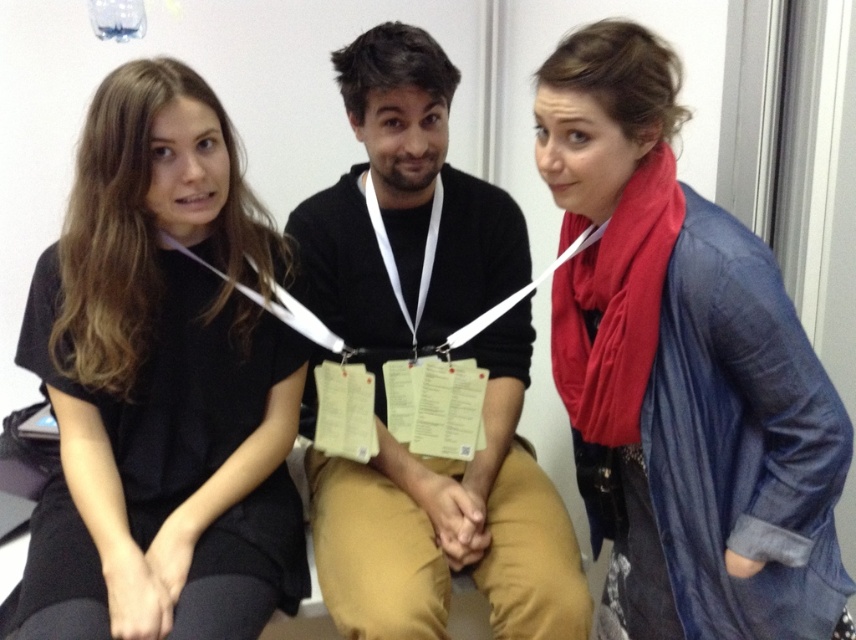
Is black matte shirt at left wider than black cotton hoodie at center?

Incorrect, black matte shirt at left's width does not surpass black cotton hoodie at center's.

Describe the element at coordinates (161, 385) in the screenshot. I see `black matte shirt at left` at that location.

What are the coordinates of `black matte shirt at left` in the screenshot? It's located at (161, 385).

Is point (556, 179) farther from camera compared to point (241, 570)?

No, (556, 179) is in front of (241, 570).

Who is positioned more to the left, denim jacket at right or black matte shirt at left?

black matte shirt at left

What are the coordinates of `denim jacket at right` in the screenshot? It's located at (682, 371).

Which is in front, point (663, 244) or point (506, 540)?

Point (663, 244) is more forward.

Based on the photo, who is lower down, denim jacket at right or black cotton hoodie at center?

denim jacket at right

Looking at this image, who is more forward, [841,481] or [357,497]?

Point [841,481] is in front.

Identify the location of denim jacket at right. (682, 371).